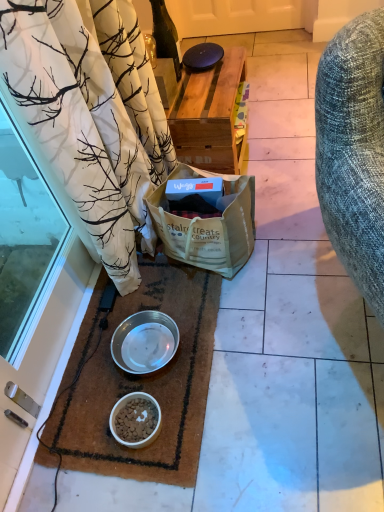
Locate an element on the screen. Image resolution: width=384 pixels, height=512 pixels. free region under black glossy tile at center (from a real-world perspective) is located at coordinates (232, 41).